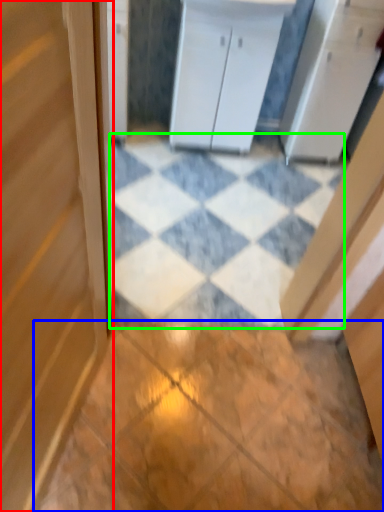
Question: Considering the real-world distances, which object is farthest from door (highlighted by a red box)? tile (highlighted by a blue box) or tile (highlighted by a green box)?

Choices:
 (A) tile
 (B) tile

Answer: (B)